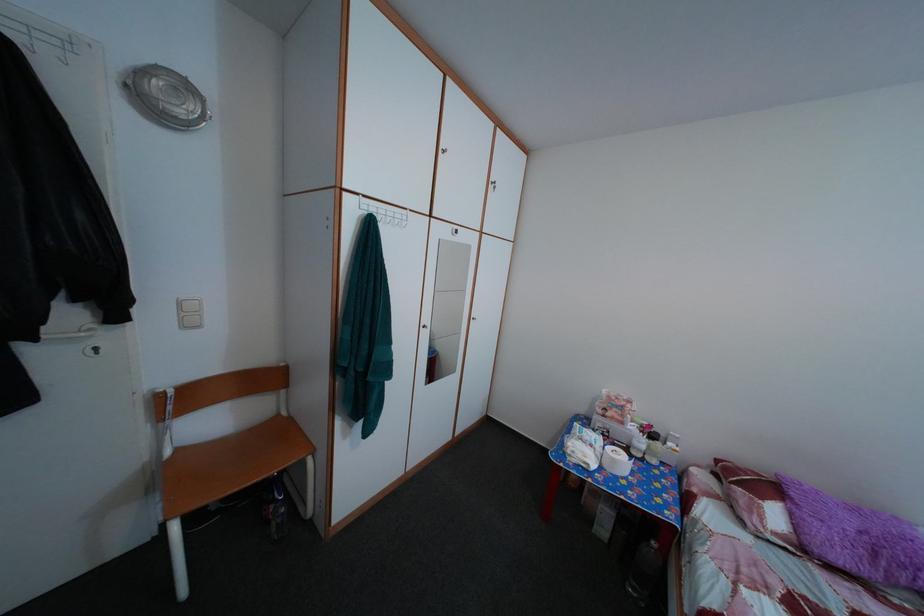
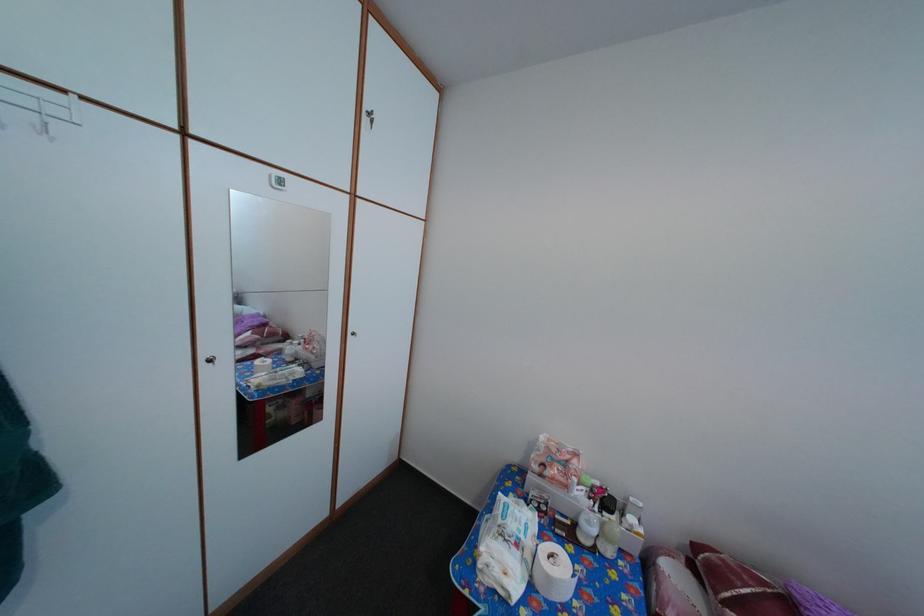
The point at (726, 469) is marked in the first image. Where is the corresponding point in the second image?

(704, 554)